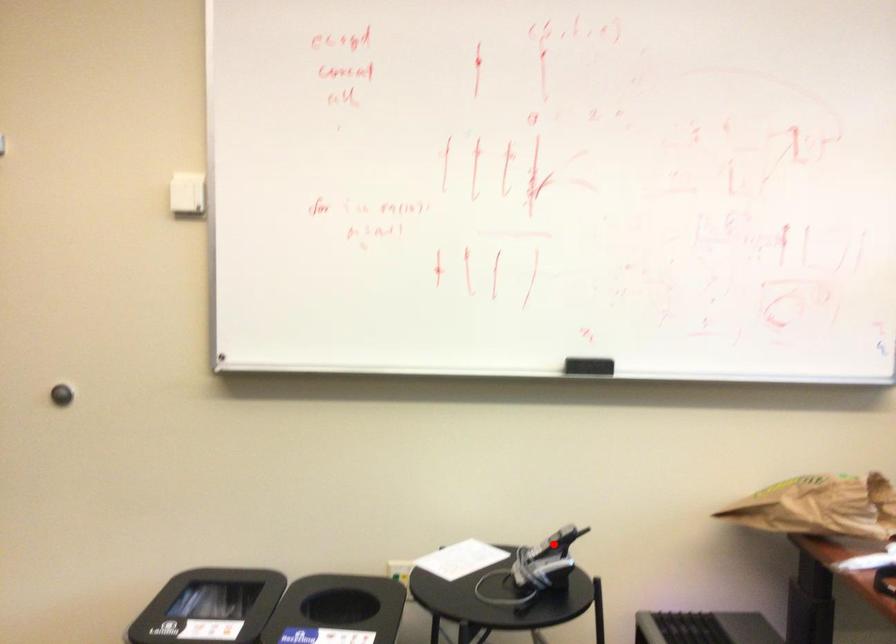
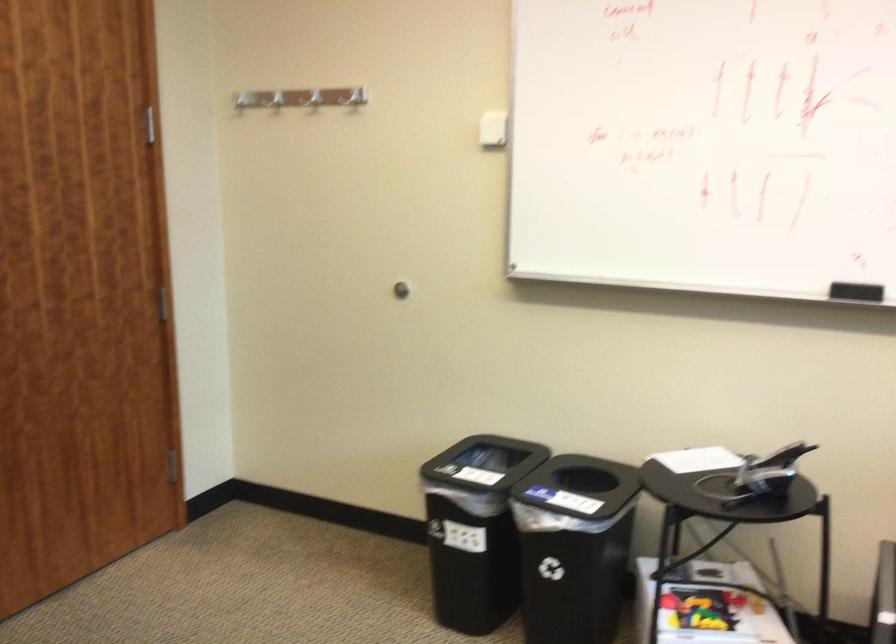
Locate, in the second image, the point that corresponds to the highlighted location in the first image.

(782, 456)